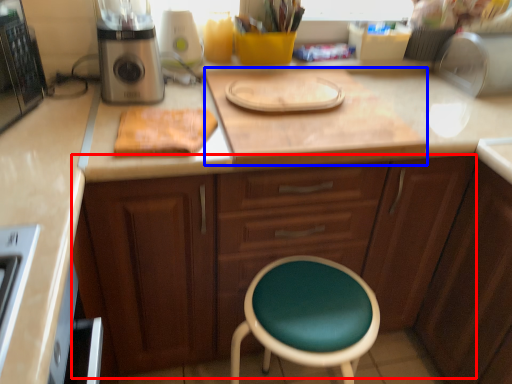
Question: Which of the following is the closest to the observer, cabinetry (highlighted by a red box) or counter top (highlighted by a blue box)?

Choices:
 (A) cabinetry
 (B) counter top

Answer: (A)